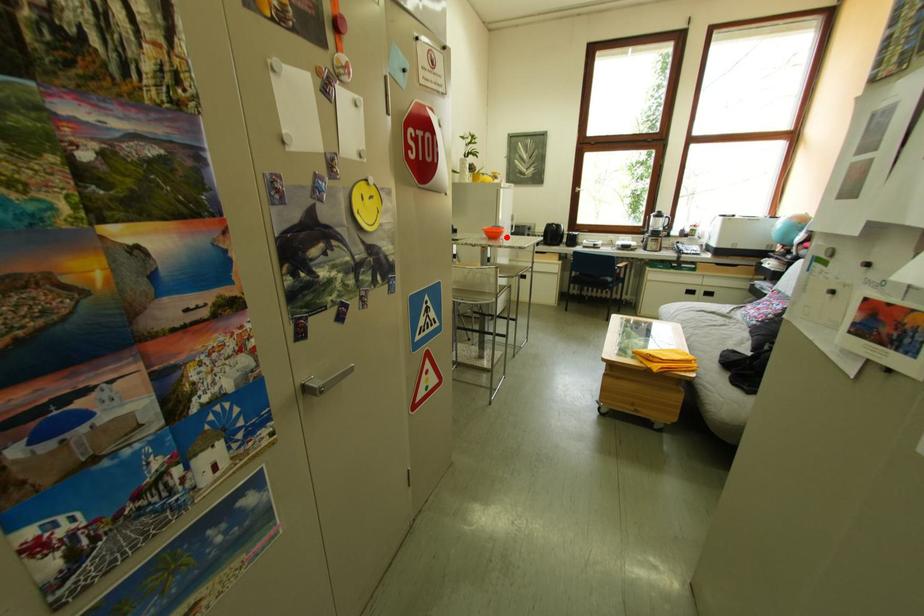
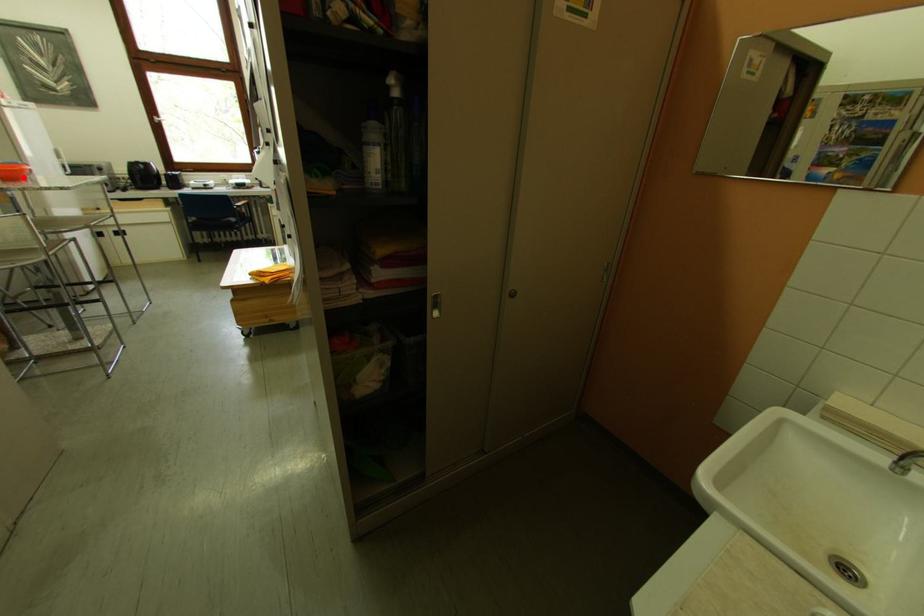
I am providing you with two images of the same scene from different viewpoints. A red point is marked on the first image and another point is marked on the second image. Does the point marked in image1 correspond to the same location as the one in image2?

Yes